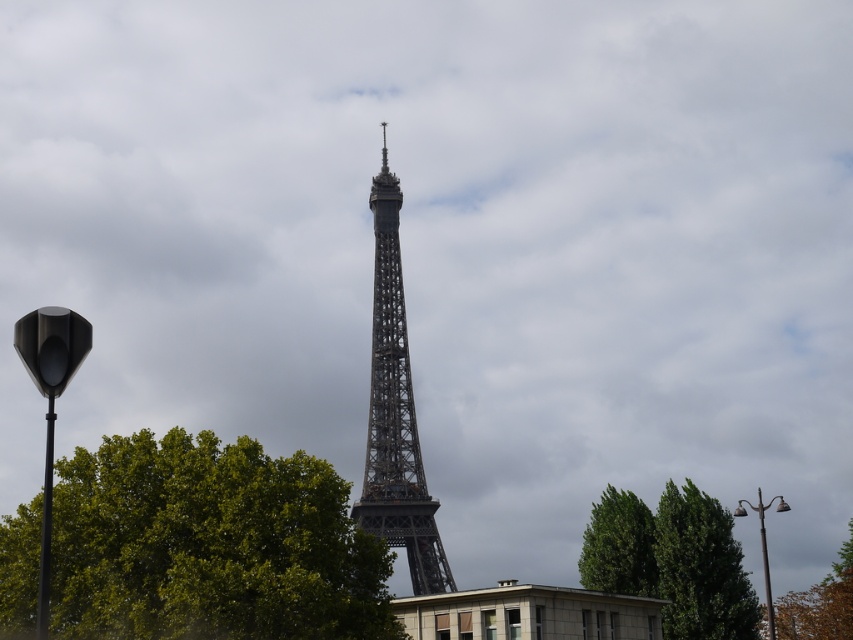
You are planning to take a photo of the metallic lattice tower at center from the position of the brown leafy tree at lower right. Considering the distance between them, will you be able to capture the entire tower in your shot without moving closer?

The distance between the metallic lattice tower at center and the brown leafy tree at lower right is 233.57 feet. At this distance, it is possible to capture the entire tower in the photo, as modern cameras can handle such distances, but you may need a wide angle lens to ensure the entire structure fits within the frame.

You are standing at the base of the Eiffel Tower and want to take a photo of the point at coordinates (635, 534). If your camera has a maximum zoom range of 200 meters, will you be able to capture the point clearly in your photo?

The distance of point (635, 534) from viewer is 271.13 meters, which exceeds the camera maximum zoom range of 200 meters. Therefore, you won not be able to capture the point clearly in your photo.